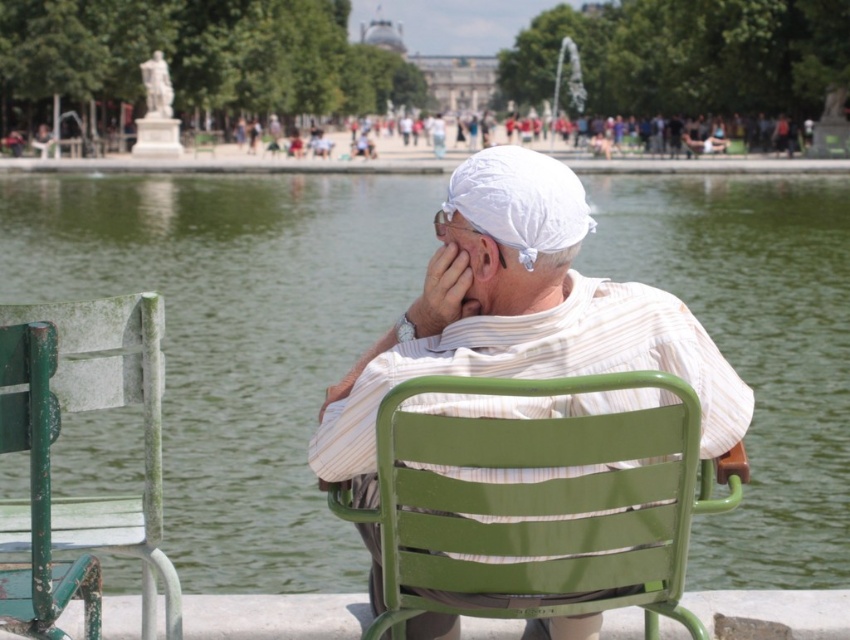
Is point (484, 268) positioned in front of point (472, 180)?

No, it is not.

Find the location of `white cotton turban at center`. white cotton turban at center is located at coordinates (520, 314).

What do you see at coordinates (110, 406) in the screenshot?
I see `green weathered wood chair at left` at bounding box center [110, 406].

Can you confirm if green weathered wood chair at left is smaller than white fabric headscarf at center?

No.

Does point (142, 308) come in front of point (442, 209)?

Yes, point (142, 308) is in front of point (442, 209).

This screenshot has width=850, height=640. I want to click on green weathered wood chair at left, so click(x=110, y=406).

Between white cotton turban at center and green weathered wood chair at left, which one is positioned higher?

green weathered wood chair at left

Is point (411, 321) farther from viewer compared to point (149, 429)?

That is True.

Does point (452, 180) come behind point (159, 541)?

That is True.

Identify the location of white cotton turban at center. (520, 314).